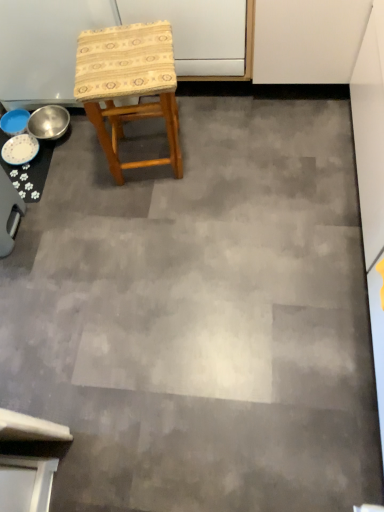
Find the location of a particular element. Image resolution: width=384 pixels, height=512 pixels. vacant area that is situated to the right of blue glossy bowls at left is located at coordinates (93, 162).